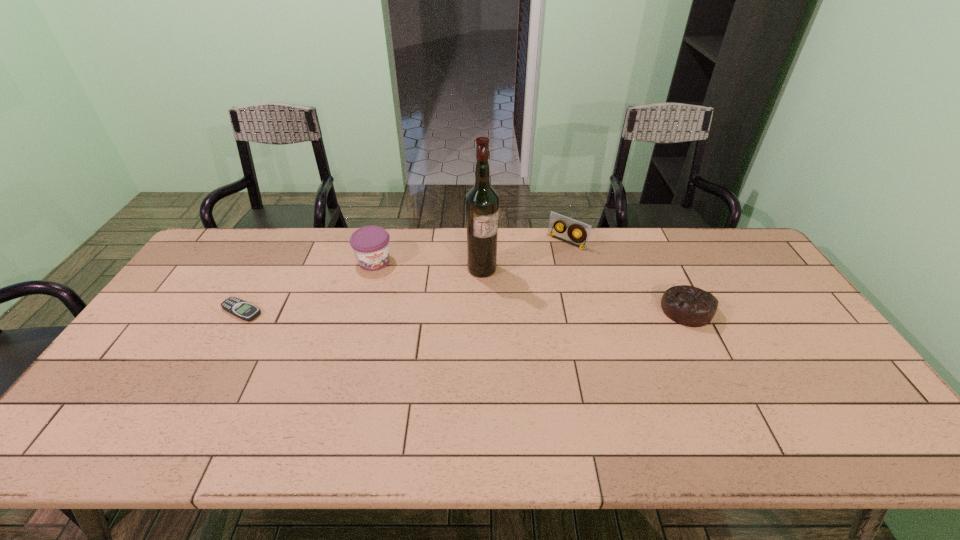
Identify the location of free space that satisfies the following two spatial constraints: 1. on the back side of the wine bottle; 2. on the right side of the beeper. The height and width of the screenshot is (540, 960). (266, 269).

The height and width of the screenshot is (540, 960). Find the location of `free location that satisfies the following two spatial constraints: 1. on the back side of the wine bottle; 2. on the right side of the second object from right to left`. free location that satisfies the following two spatial constraints: 1. on the back side of the wine bottle; 2. on the right side of the second object from right to left is located at coordinates (482, 242).

Where is `free spot that satisfies the following two spatial constraints: 1. on the back side of the fourth object from left to right; 2. on the left side of the shortest object`? This screenshot has width=960, height=540. free spot that satisfies the following two spatial constraints: 1. on the back side of the fourth object from left to right; 2. on the left side of the shortest object is located at coordinates (281, 242).

Where is `free space that satisfies the following two spatial constraints: 1. on the back side of the leftmost object; 2. on the left side of the second object from right to left`? free space that satisfies the following two spatial constraints: 1. on the back side of the leftmost object; 2. on the left side of the second object from right to left is located at coordinates (281, 242).